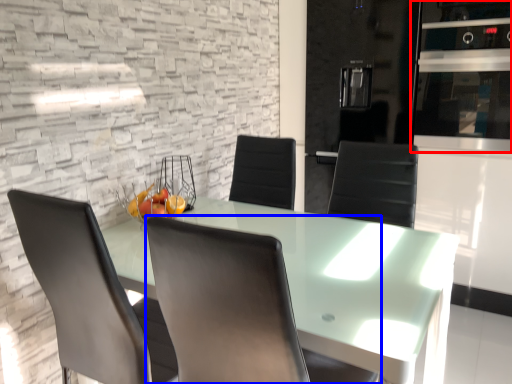
Question: Which object appears farthest to the camera in this image, appliance (highlighted by a red box) or chair (highlighted by a blue box)?

Choices:
 (A) appliance
 (B) chair

Answer: (A)